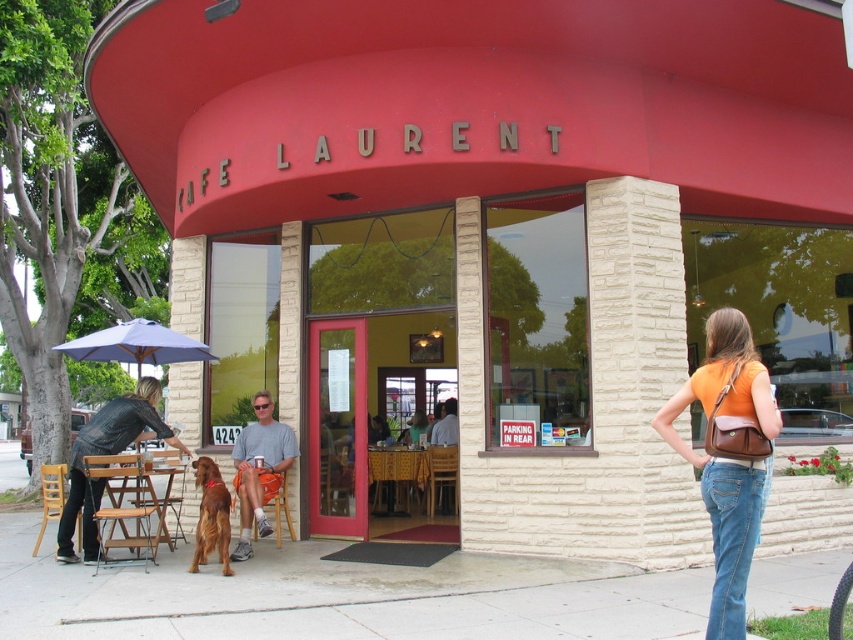
You are standing in front of the entrance of the cafe and see two points marked on the ground. The first point is at point [761,444] and the second is at point [287,426]. Which point is closer to you?

Point [761,444] is closer to the viewer than point [287,426].

You are a customer at the outdoor seating area of the cafe. You see a person sitting at a table with a denim jacket at lower left and gray fabric shorts at lower left. Which item is closer to the ground?

The gray fabric shorts at lower left are closer to the ground because the denim jacket at lower left is located above it.

You are a service robot at the entrance of the cafe. You need to retrieve the orange leather purse at right and the shiny brown dog at lower left. What is the shortest distance you need to travel to collect both items?

The shortest distance to collect both items is 4.07 meters, as the orange leather purse at right is 4.07 meters away from the shiny brown dog at lower left.